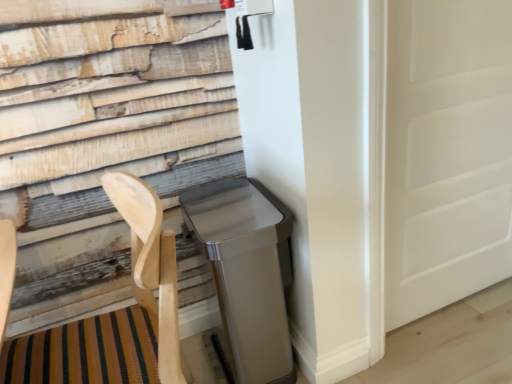
Measure the distance between satin silver trash can at lower right and camera.

satin silver trash can at lower right is 1.16 meters from camera.

Where is `white matte door at right`? white matte door at right is located at coordinates (446, 153).

Where is `satin silver trash can at lower right`? The height and width of the screenshot is (384, 512). satin silver trash can at lower right is located at coordinates (247, 272).

Do you think white matte door at right is within satin silver trash can at lower right, or outside of it?

white matte door at right cannot be found inside satin silver trash can at lower right.

In the scene shown: Is the surface of white matte door at right in direct contact with satin silver trash can at lower right?

No, white matte door at right is not making contact with satin silver trash can at lower right.

Does point (434, 204) lie behind point (281, 355)?

Yes, it is.

Between white matte door at right and satin silver trash can at lower right, which one is positioned in front?

satin silver trash can at lower right is more forward.

What's the angular difference between natural wood folding chair at lower left and white matte door at right's facing directions?

There is a 93.1-degree angle between the facing directions of natural wood folding chair at lower left and white matte door at right.

Does natural wood folding chair at lower left appear on the left side of white matte door at right?

Correct, you'll find natural wood folding chair at lower left to the left of white matte door at right.

Considering their positions, is natural wood folding chair at lower left located in front of or behind white matte door at right?

In the image, natural wood folding chair at lower left appears in front of white matte door at right.

Looking at this image, is natural wood folding chair at lower left smaller than white matte door at right?

Incorrect, natural wood folding chair at lower left is not smaller in size than white matte door at right.

Which object is closer to the camera, satin silver trash can at lower right or white matte door at right?

satin silver trash can at lower right is in front.

Based on the photo, is satin silver trash can at lower right aimed at white matte door at right?

No, satin silver trash can at lower right is not aimed at white matte door at right.

Who is taller, satin silver trash can at lower right or white matte door at right?

white matte door at right is taller.

From the image's perspective, is satin silver trash can at lower right above natural wood folding chair at lower left?

Yes.

Looking at this image, is satin silver trash can at lower right at the left side of natural wood folding chair at lower left?

No, satin silver trash can at lower right is not to the left of natural wood folding chair at lower left.

Is satin silver trash can at lower right in front of natural wood folding chair at lower left?

No.

Looking at their sizes, would you say satin silver trash can at lower right is wider or thinner than natural wood folding chair at lower left?

Clearly, satin silver trash can at lower right has less width compared to natural wood folding chair at lower left.

Find the location of a particular element. waste container lying above the natural wood folding chair at lower left (from the image's perspective) is located at coordinates [247, 272].

Considering the relative sizes of natural wood folding chair at lower left and satin silver trash can at lower right in the image provided, is natural wood folding chair at lower left wider than satin silver trash can at lower right?

Correct, the width of natural wood folding chair at lower left exceeds that of satin silver trash can at lower right.

From a real-world perspective, is natural wood folding chair at lower left physically located above or below satin silver trash can at lower right?

natural wood folding chair at lower left is above satin silver trash can at lower right.

From the image's perspective, who appears lower, natural wood folding chair at lower left or satin silver trash can at lower right?

natural wood folding chair at lower left is shown below in the image.

In the scene shown: Is white matte door at right bigger or smaller than natural wood folding chair at lower left?

Clearly, white matte door at right is smaller in size than natural wood folding chair at lower left.

From a real-world perspective, is white matte door at right beneath natural wood folding chair at lower left?

No.

Which point is more forward, (470, 72) or (42, 353)?

Point (42, 353)

You are a GUI agent. You are given a task and a screenshot of the screen. Output one action in this format:
    pyautogui.click(x=<x>, y=<y>)
    Task: Click on the screen door above the satin silver trash can at lower right (from the image's perspective)
    
    Given the screenshot: What is the action you would take?
    pyautogui.click(x=446, y=153)

In order to click on folding chair on the left of white matte door at right in this screenshot , I will do `click(151, 268)`.

Looking at the image, which one is located closer to natural wood folding chair at lower left, satin silver trash can at lower right or white matte door at right?

satin silver trash can at lower right is closer to natural wood folding chair at lower left.

Which object lies nearer to the anchor point white matte door at right, satin silver trash can at lower right or natural wood folding chair at lower left?

satin silver trash can at lower right lies closer to white matte door at right than the other object.

Based on their spatial positions, is natural wood folding chair at lower left or white matte door at right further from satin silver trash can at lower right?

The object further to satin silver trash can at lower right is white matte door at right.

Considering their positions, is white matte door at right positioned further to natural wood folding chair at lower left than satin silver trash can at lower right?

Based on the image, white matte door at right appears to be further to natural wood folding chair at lower left.

From the image, which object appears to be farther from satin silver trash can at lower right, white matte door at right or natural wood folding chair at lower left?

Among the two, white matte door at right is located further to satin silver trash can at lower right.

Based on their spatial positions, is natural wood folding chair at lower left or satin silver trash can at lower right further from white matte door at right?

natural wood folding chair at lower left is further to white matte door at right.

In order to click on waste container between natural wood folding chair at lower left and white matte door at right from left to right in this screenshot , I will do `click(247, 272)`.